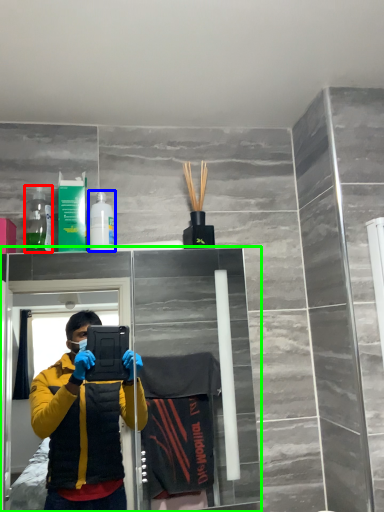
Question: Which object is positioned closest to bottle (highlighted by a red box)? Select from toiletry (highlighted by a blue box) and glass door (highlighted by a green box).

Choices:
 (A) toiletry
 (B) glass door

Answer: (A)